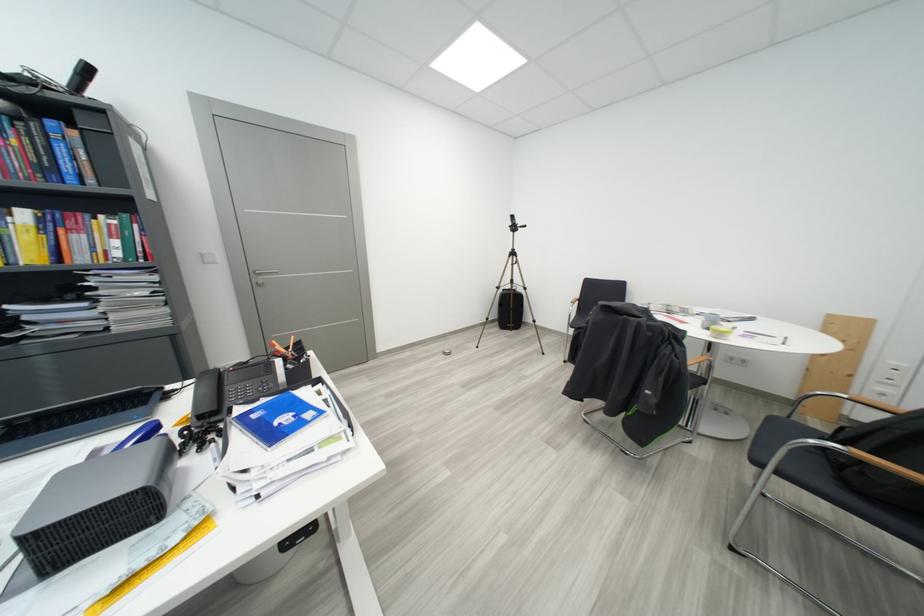
The width and height of the screenshot is (924, 616). What do you see at coordinates (791, 466) in the screenshot?
I see `the metal chair armrest` at bounding box center [791, 466].